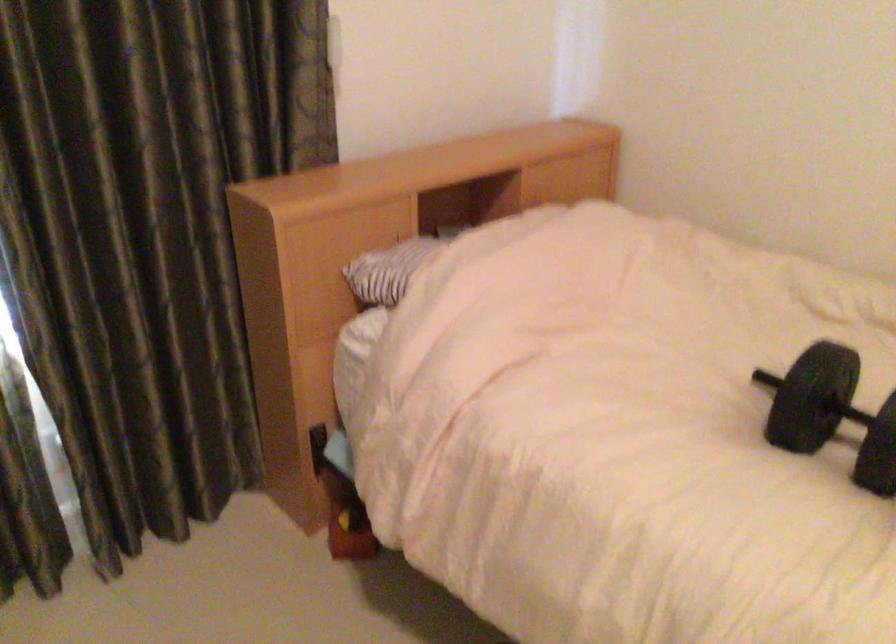
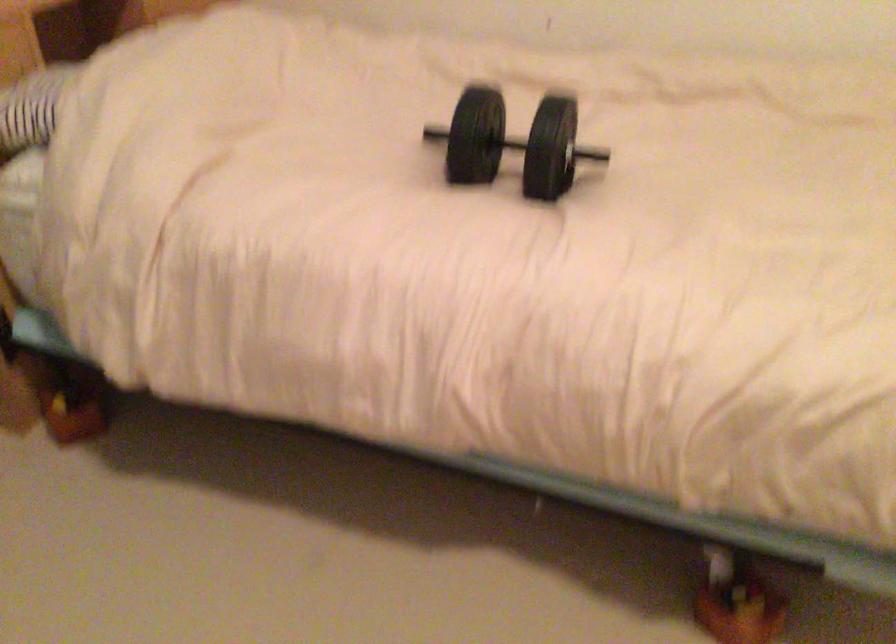
Question: The images are taken continuously from a first-person perspective. In which direction is your viewpoint rotating?

Choices:
 (A) Left
 (B) Right
 (C) Up
 (D) Down

Answer: (B)